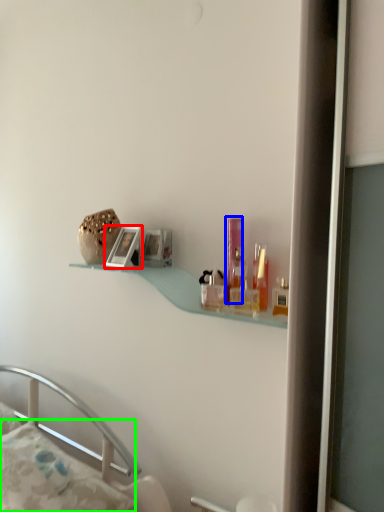
Question: Which is farther away from picture frame (highlighted by a red box)? toiletry (highlighted by a blue box) or pillow (highlighted by a green box)?

Choices:
 (A) toiletry
 (B) pillow

Answer: (B)